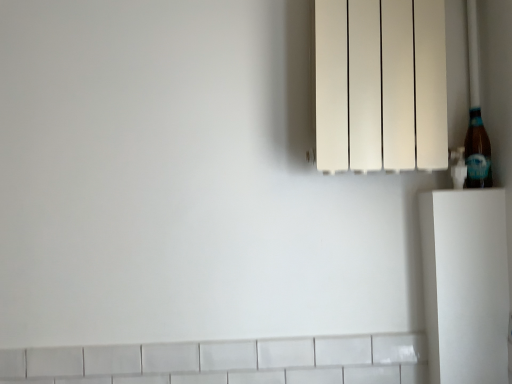
Find the location of a particular element. The width and height of the screenshot is (512, 384). white matte radiator at upper right is located at coordinates (380, 85).

Describe the element at coordinates (380, 85) in the screenshot. I see `white matte radiator at upper right` at that location.

Locate an element on the screen. Image resolution: width=512 pixels, height=384 pixels. brown glass bottle at right is located at coordinates (477, 152).

What do you see at coordinates (477, 152) in the screenshot? The width and height of the screenshot is (512, 384). I see `brown glass bottle at right` at bounding box center [477, 152].

Find the location of a particular element. white matte radiator at upper right is located at coordinates (380, 85).

Does white matte radiator at upper right appear on the left side of brown glass bottle at right?

Yes, white matte radiator at upper right is to the left of brown glass bottle at right.

Between white matte radiator at upper right and brown glass bottle at right, which one is positioned behind?

Positioned behind is brown glass bottle at right.

Between point (403, 51) and point (468, 144), which one is positioned in front?

The point (403, 51) is closer to the camera.

From the image's perspective, between white matte radiator at upper right and brown glass bottle at right, which one is located above?

white matte radiator at upper right, from the image's perspective.

From a real-world perspective, who is located higher, white matte radiator at upper right or brown glass bottle at right?

In real-world perspective, white matte radiator at upper right is above.

Which of these two, white matte radiator at upper right or brown glass bottle at right, is wider?

Wider between the two is white matte radiator at upper right.

Is white matte radiator at upper right taller or shorter than brown glass bottle at right?

In the image, white matte radiator at upper right appears to be taller than brown glass bottle at right.

Does white matte radiator at upper right have a smaller size compared to brown glass bottle at right?

Actually, white matte radiator at upper right might be larger than brown glass bottle at right.

Is white matte radiator at upper right situated inside brown glass bottle at right or outside?

white matte radiator at upper right is located beyond the bounds of brown glass bottle at right.

In the scene shown: Is white matte radiator at upper right directly adjacent to brown glass bottle at right?

No, white matte radiator at upper right is not touching brown glass bottle at right.

Is white matte radiator at upper right turned away from brown glass bottle at right?

That's right, white matte radiator at upper right is facing away from brown glass bottle at right.

How many degrees apart are the facing directions of white matte radiator at upper right and brown glass bottle at right?

There is a 0.683-degree angle between the facing directions of white matte radiator at upper right and brown glass bottle at right.

This screenshot has width=512, height=384. I want to click on lamp in front of the brown glass bottle at right, so click(380, 85).

Visually, is brown glass bottle at right positioned to the left or to the right of white matte radiator at upper right?

brown glass bottle at right is to the right of white matte radiator at upper right.

Which is behind, brown glass bottle at right or white matte radiator at upper right?

brown glass bottle at right.

Considering the positions of points (467, 148) and (414, 161), is point (467, 148) farther from camera compared to point (414, 161)?

Yes, it is.

Based on the photo, from the image's perspective, which is below, brown glass bottle at right or white matte radiator at upper right?

brown glass bottle at right is shown below in the image.

From a real-world perspective, is brown glass bottle at right positioned above or below white matte radiator at upper right?

In terms of real-world spatial position, brown glass bottle at right is below white matte radiator at upper right.

Based on the photo, can you confirm if brown glass bottle at right is thinner than white matte radiator at upper right?

Yes, brown glass bottle at right is thinner than white matte radiator at upper right.

Considering the sizes of brown glass bottle at right and white matte radiator at upper right in the image, is brown glass bottle at right taller or shorter than white matte radiator at upper right?

Clearly, brown glass bottle at right is shorter compared to white matte radiator at upper right.

Considering the sizes of objects brown glass bottle at right and white matte radiator at upper right in the image provided, who is bigger, brown glass bottle at right or white matte radiator at upper right?

With larger size is white matte radiator at upper right.

In the scene shown: Would you say brown glass bottle at right is outside white matte radiator at upper right?

That's incorrect, brown glass bottle at right is not completely outside white matte radiator at upper right.

Are brown glass bottle at right and white matte radiator at upper right far apart?

No, brown glass bottle at right is in close proximity to white matte radiator at upper right.

Is white matte radiator at upper right at the back of brown glass bottle at right?

Absolutely, brown glass bottle at right is directed away from white matte radiator at upper right.

How different are the orientations of brown glass bottle at right and white matte radiator at upper right in degrees?

0.683 degrees.

Measure the distance from brown glass bottle at right to white matte radiator at upper right.

The distance of brown glass bottle at right from white matte radiator at upper right is 10.60 inches.

Where is `bottle behind the white matte radiator at upper right`? This screenshot has width=512, height=384. bottle behind the white matte radiator at upper right is located at coordinates (477, 152).

At what (x,y) coordinates should I click in order to perform the action: click on lamp above the brown glass bottle at right (from a real-world perspective). Please return your answer as a coordinate pair (x, y). Looking at the image, I should click on (380, 85).

I want to click on bottle below the white matte radiator at upper right (from a real-world perspective), so click(477, 152).